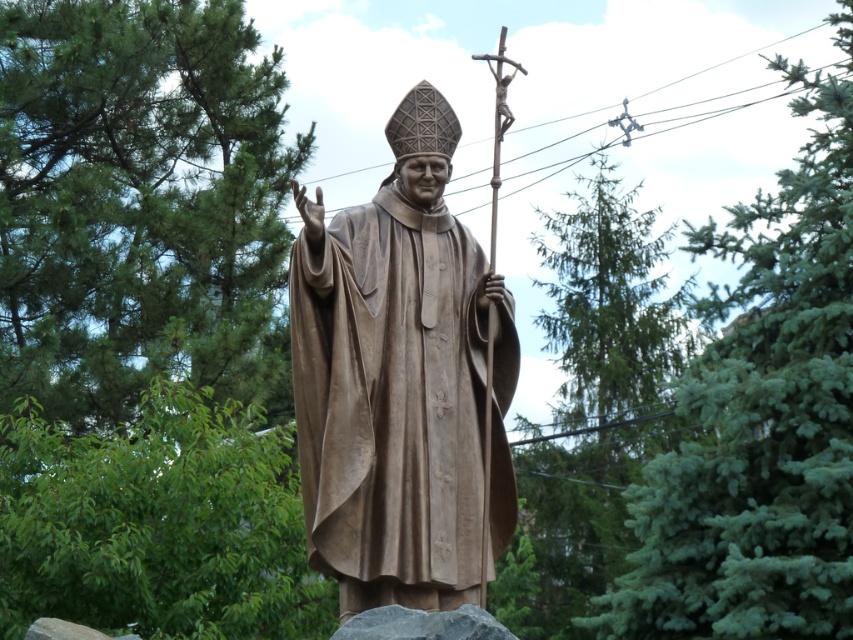
Question: Which is nearer to the green leafy tree at upper left?

Choices:
 (A) green coniferous tree at upper right
 (B) bronze statue at center
 (C) green needle-like foliage at upper center

Answer: (A)

Question: Can you confirm if bronze statue at center is positioned to the right of green coniferous tree at upper right?

Choices:
 (A) yes
 (B) no

Answer: (B)

Question: Which object is positioned farthest from the green leafy tree at upper left?

Choices:
 (A) bronze statue at center
 (B) green needle-like foliage at upper center

Answer: (A)

Question: Is the position of green leafy tree at upper left more distant than that of green needle-like foliage at upper center?

Choices:
 (A) no
 (B) yes

Answer: (B)

Question: Among these points, which one is nearest to the camera?

Choices:
 (A) 757,428
 (B) 126,324
 (C) 607,202
 (D) 409,163

Answer: (D)

Question: Can you confirm if green leafy tree at upper left is positioned to the right of bronze statue at center?

Choices:
 (A) yes
 (B) no

Answer: (B)